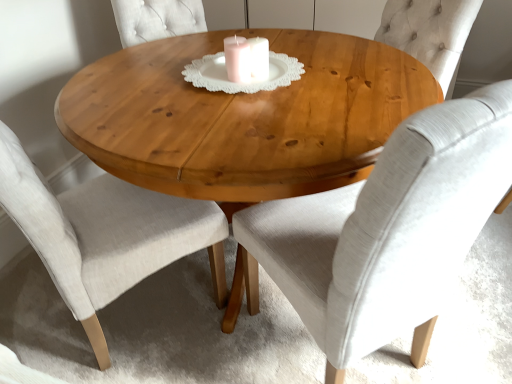
Question: Does natural wood table at center lie behind light gray fabric chair at center, which is counted as the 1th chair, starting from the right?

Choices:
 (A) no
 (B) yes

Answer: (B)

Question: Is natural wood table at center facing towards light gray fabric chair at center, which is the second chair from left to right?

Choices:
 (A) yes
 (B) no

Answer: (A)

Question: From the image's perspective, is natural wood table at center beneath light gray fabric chair at center, which is the second chair from left to right?

Choices:
 (A) no
 (B) yes

Answer: (A)

Question: Does natural wood table at center touch light gray fabric chair at center, which is counted as the 1th chair, starting from the right?

Choices:
 (A) yes
 (B) no

Answer: (B)

Question: Is light gray fabric chair at center, which is counted as the 1th chair, starting from the right, surrounded by natural wood table at center?

Choices:
 (A) no
 (B) yes

Answer: (B)

Question: From a real-world perspective, relative to light beige fabric chair at center, positioned as the first chair in left-to-right order, is natural wood table at center vertically above or below?

Choices:
 (A) above
 (B) below

Answer: (B)

Question: Considering the positions of natural wood table at center and light beige fabric chair at center, the second chair from the right, in the image, is natural wood table at center taller or shorter than light beige fabric chair at center, the second chair from the right,?

Choices:
 (A) short
 (B) tall

Answer: (A)

Question: Based on their sizes in the image, would you say natural wood table at center is bigger or smaller than light beige fabric chair at center, the second chair from the right?

Choices:
 (A) small
 (B) big

Answer: (B)

Question: Does point (374, 137) appear closer or farther from the camera than point (154, 231)?

Choices:
 (A) closer
 (B) farther

Answer: (A)

Question: Is light beige fabric chair at center, the second chair from the right, bigger or smaller than light gray fabric chair at center, which is counted as the 1th chair, starting from the right?

Choices:
 (A) big
 (B) small

Answer: (B)

Question: From the image's perspective, is light beige fabric chair at center, positioned as the first chair in left-to-right order, positioned above or below light gray fabric chair at center, which is counted as the 1th chair, starting from the right?

Choices:
 (A) above
 (B) below

Answer: (A)

Question: Would you say light beige fabric chair at center, the second chair from the right, is inside or outside light gray fabric chair at center, which is counted as the 1th chair, starting from the right?

Choices:
 (A) inside
 (B) outside

Answer: (B)

Question: Does point (87, 329) appear closer or farther from the camera than point (496, 127)?

Choices:
 (A) closer
 (B) farther

Answer: (B)

Question: Is point (501, 102) positioned closer to the camera than point (106, 152)?

Choices:
 (A) closer
 (B) farther

Answer: (A)

Question: Is light gray fabric chair at center, which is counted as the 1th chair, starting from the right, bigger or smaller than natural wood table at center?

Choices:
 (A) small
 (B) big

Answer: (A)